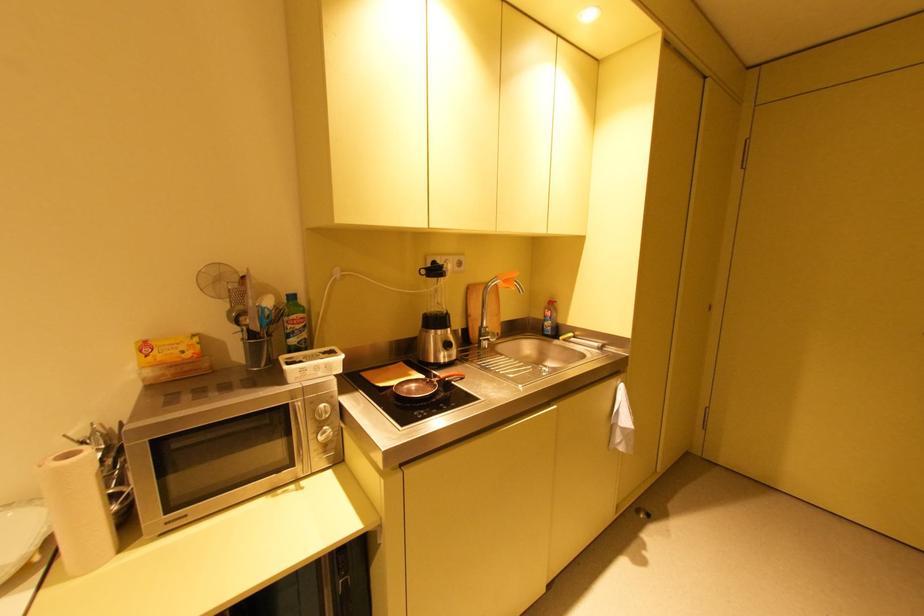
What do you see at coordinates (550, 314) in the screenshot?
I see `the red bottle cap` at bounding box center [550, 314].